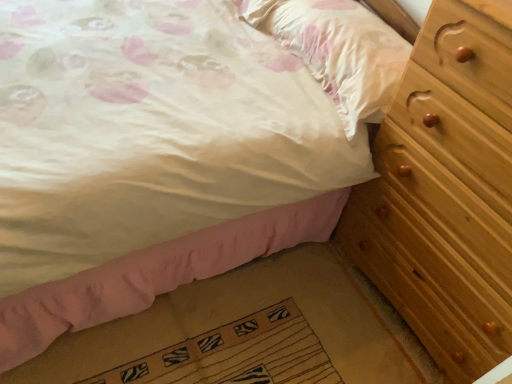
Identify the location of free space above textured beige mat at lower center (from a real-world perspective). The image size is (512, 384). (232, 355).